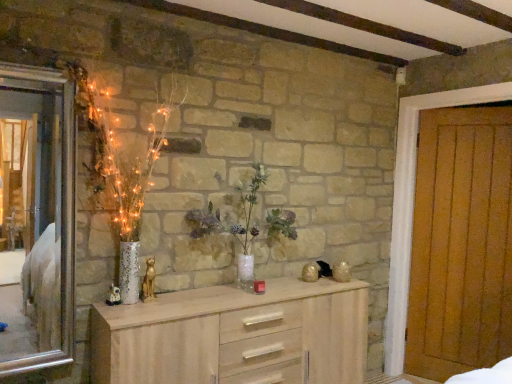
Locate an element on the screen. empty space that is ontop of wooden door at right is located at coordinates (465, 82).